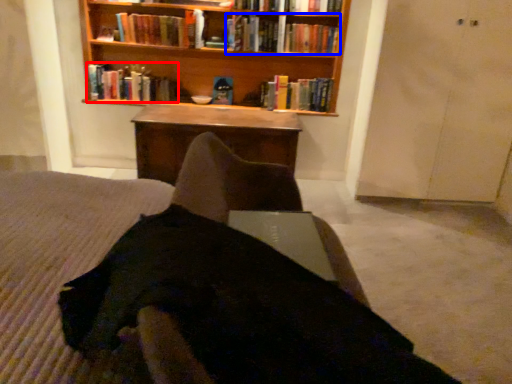
Question: Which of the following is the farthest to the observer, book (highlighted by a red box) or book (highlighted by a blue box)?

Choices:
 (A) book
 (B) book

Answer: (A)